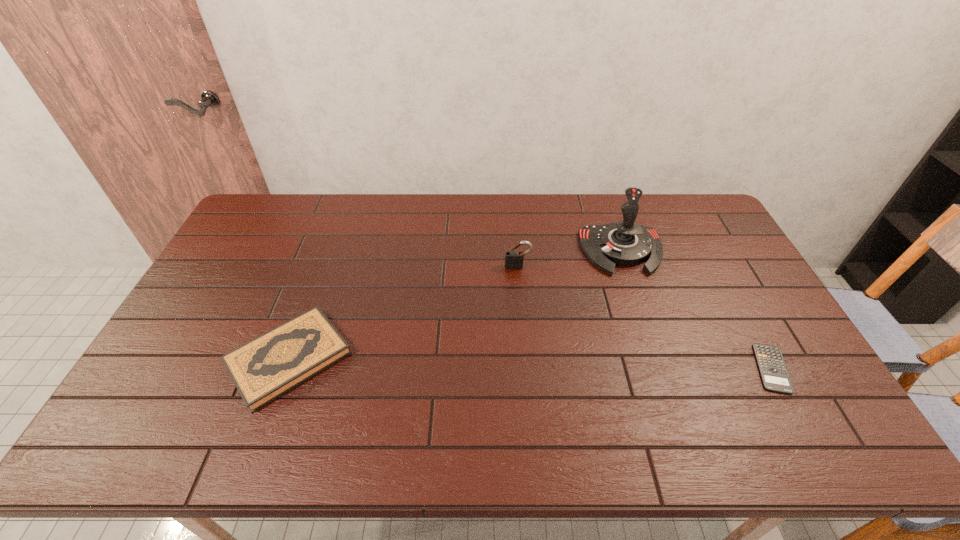
Locate which object ranks second in proximity to the leftmost object. Please provide its 2D coordinates. Your answer should be formatted as a tuple, i.e. [(x, y)], where the tuple contains the x and y coordinates of a point satisfying the conditions above.

[(625, 243)]

The width and height of the screenshot is (960, 540). Find the location of `free space that satisfies the following two spatial constraints: 1. with the keyhole on the front of the rightmost object; 2. on the left side of the padlock`. free space that satisfies the following two spatial constraints: 1. with the keyhole on the front of the rightmost object; 2. on the left side of the padlock is located at coordinates (527, 368).

Where is `vacant space that satisfies the following two spatial constraints: 1. with the keyhole on the front of the padlock; 2. on the right side of the calculator`? vacant space that satisfies the following two spatial constraints: 1. with the keyhole on the front of the padlock; 2. on the right side of the calculator is located at coordinates (527, 368).

Where is `free space that satisfies the following two spatial constraints: 1. with the keyhole on the front of the shortest object; 2. on the left side of the padlock`? The height and width of the screenshot is (540, 960). free space that satisfies the following two spatial constraints: 1. with the keyhole on the front of the shortest object; 2. on the left side of the padlock is located at coordinates (527, 368).

Image resolution: width=960 pixels, height=540 pixels. I want to click on free spot that satisfies the following two spatial constraints: 1. on the handle side of the third object from left to right; 2. on the left side of the rightmost object, so click(661, 368).

The image size is (960, 540). I want to click on vacant position in the image that satisfies the following two spatial constraints: 1. with the keyhole on the front of the calculator; 2. on the left side of the second object from left to right, so click(527, 368).